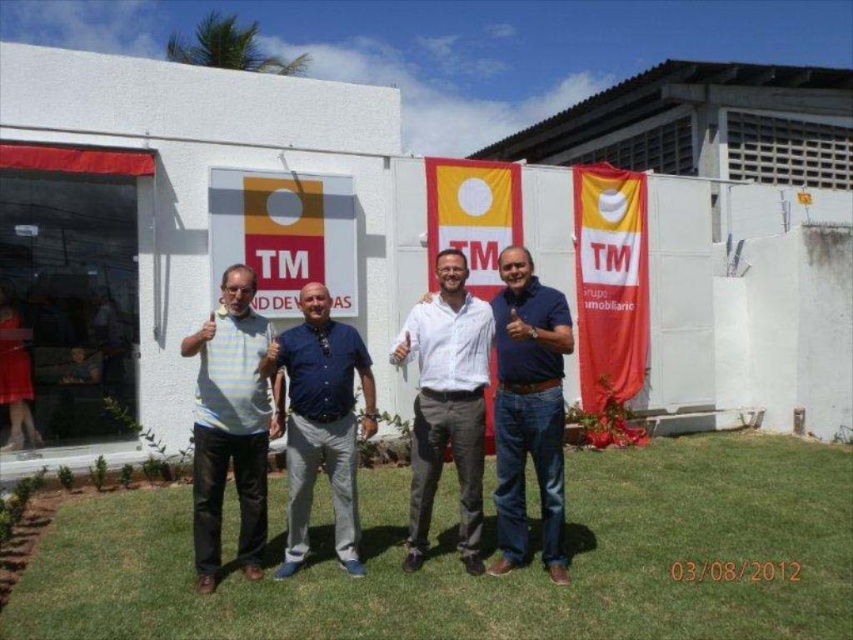
In the scene shown: You are taking a photo of the scene and want to focus on both the point at position (795, 582) and the point at (263, 388). Which point should you adjust your camera focus to first to ensure both are in focus?

You should focus on the point at position (795, 582) first because it is closer to the camera than the point at (263, 388). By focusing on the closer point, the farther point will also be within the depth of field.

You are a photographer trying to capture a clear shot of both the striped cotton shirt at center and the blue denim jeans at center. Since the camera can only focus on one subject at a time, which one should you choose to ensure the other is still somewhat in focus?

The striped cotton shirt at center is closer to the viewer than the blue denim jeans at center. By focusing on the striped cotton shirt at center, the blue denim jeans at center will be slightly out of focus. Alternatively, focusing on the blue denim jeans at center would leave the striped cotton shirt at center more out of focus. To have both somewhat in focus, focus on the middle distance between them, but since the camera can only focus on one, choosing the one farther away might keep the closer one in a

You are a photographer setting up a shot of the scene. You need to ensure that the green grass at lower center and the white cotton shirt at center are both visible in the frame. Given their sizes, which object will occupy more space in the photo?

The green grass at lower center will occupy more space in the photo because its width is larger than that of the white cotton shirt at center.